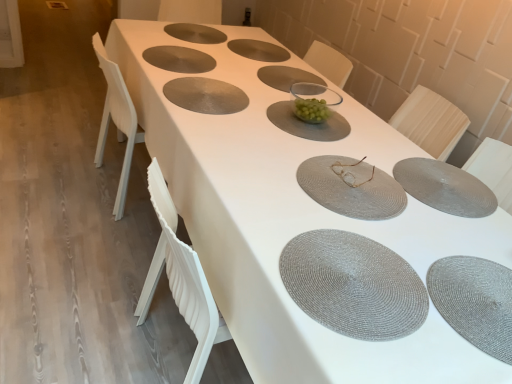
Question: Is matte gray placemat at upper center, the second tableware from the top, at the left side of green glass bowl at center, arranged as the 5th tableware when ordered from the bottom?

Choices:
 (A) yes
 (B) no

Answer: (A)

Question: Is matte gray placemat at upper center, the second tableware from the top, at the right side of green glass bowl at center, positioned as the 5th tableware in top-to-bottom order?

Choices:
 (A) no
 (B) yes

Answer: (A)

Question: From a real-world perspective, is matte gray placemat at upper center, the second tableware from the top, located beneath green glass bowl at center, arranged as the 5th tableware when ordered from the bottom?

Choices:
 (A) yes
 (B) no

Answer: (A)

Question: Could green glass bowl at center, positioned as the 5th tableware in top-to-bottom order, be considered to be inside matte gray placemat at upper center, which ranks as the eighth tableware in bottom-to-top order?

Choices:
 (A) no
 (B) yes

Answer: (A)

Question: From a real-world perspective, is matte gray placemat at upper center, which ranks as the eighth tableware in bottom-to-top order, over green glass bowl at center, arranged as the 5th tableware when ordered from the bottom?

Choices:
 (A) no
 (B) yes

Answer: (A)

Question: Is point (169, 62) closer or farther from the camera than point (275, 77)?

Choices:
 (A) closer
 (B) farther

Answer: (A)

Question: From the image's perspective, is matte gray placemat at upper center, the third tableware from the top, located above or below gray woven placemat at center?

Choices:
 (A) above
 (B) below

Answer: (A)

Question: Considering their positions, is matte gray placemat at upper center, the third tableware from the top, located in front of or behind gray woven placemat at center?

Choices:
 (A) behind
 (B) front

Answer: (B)

Question: In terms of size, does matte gray placemat at upper center, the third tableware from the top, appear bigger or smaller than gray woven placemat at center?

Choices:
 (A) small
 (B) big

Answer: (B)

Question: In the image, is green glass bowl at center, arranged as the 5th tableware when ordered from the bottom, positioned in front of or behind gold metallic glasses at center, which is the fourth tableware from bottom to top?

Choices:
 (A) front
 (B) behind

Answer: (B)

Question: Looking at the image, does green glass bowl at center, positioned as the 5th tableware in top-to-bottom order, seem bigger or smaller compared to gold metallic glasses at center, which is the fourth tableware from bottom to top?

Choices:
 (A) small
 (B) big

Answer: (B)

Question: Looking at their shapes, would you say green glass bowl at center, positioned as the 5th tableware in top-to-bottom order, is wider or thinner than gold metallic glasses at center, which is the fourth tableware from bottom to top?

Choices:
 (A) thin
 (B) wide

Answer: (B)

Question: From the image's perspective, relative to gold metallic glasses at center, the 6th tableware when ordered from top to bottom, is green glass bowl at center, arranged as the 5th tableware when ordered from the bottom, above or below?

Choices:
 (A) above
 (B) below

Answer: (A)

Question: Relative to gray woven placemat at center, is clear glass bowl at center, arranged as the 6th tableware when ordered from the bottom, in front or behind?

Choices:
 (A) behind
 (B) front

Answer: (A)

Question: From a real-world perspective, is clear glass bowl at center, which ranks as the 4th tableware in top-to-bottom order, physically located above or below gray woven placemat at center?

Choices:
 (A) below
 (B) above

Answer: (B)